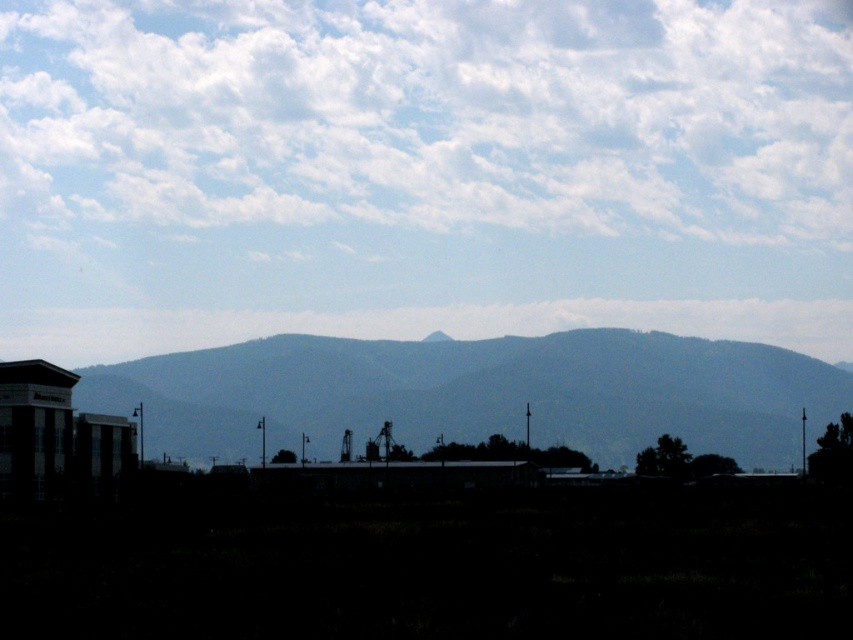
Does white fluffy cloud at upper center have a lesser width compared to gray textured mountain range at center?

No, white fluffy cloud at upper center is not thinner than gray textured mountain range at center.

Describe the element at coordinates (432, 116) in the screenshot. I see `white fluffy cloud at upper center` at that location.

The height and width of the screenshot is (640, 853). Find the location of `white fluffy cloud at upper center`. white fluffy cloud at upper center is located at coordinates (432, 116).